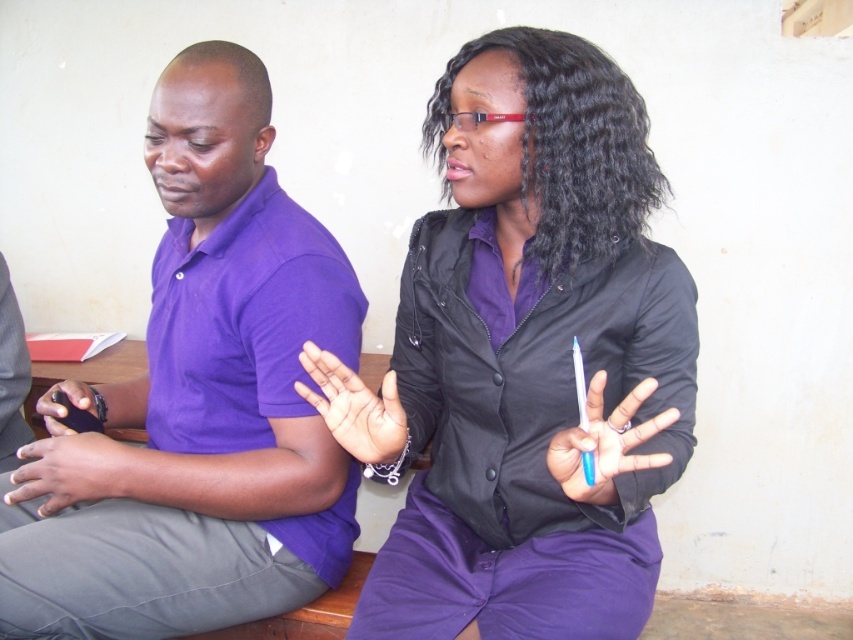
Question: Considering the relative positions of purple matte shirt at left and matte black phone at left in the image provided, where is purple matte shirt at left located with respect to matte black phone at left?

Choices:
 (A) left
 (B) right

Answer: (B)

Question: Which of these objects is positioned farthest from the smooth skin hand at center?

Choices:
 (A) matte black shirt at center
 (B) matte black phone at left

Answer: (B)

Question: Is the position of blue plastic pen at center more distant than that of matte black phone at left?

Choices:
 (A) no
 (B) yes

Answer: (A)

Question: Which object is positioned farthest from the matte black shirt at center?

Choices:
 (A) smooth skin hand at center
 (B) purple matte shirt at left
 (C) matte black phone at left
 (D) dark skin hand at lower left

Answer: (C)

Question: Among these objects, which one is farthest from the camera?

Choices:
 (A) matte black phone at left
 (B) dark skin hand at lower left
 (C) smooth skin hand at center

Answer: (A)

Question: Is smooth skin hand at center above matte black phone at left?

Choices:
 (A) no
 (B) yes

Answer: (B)